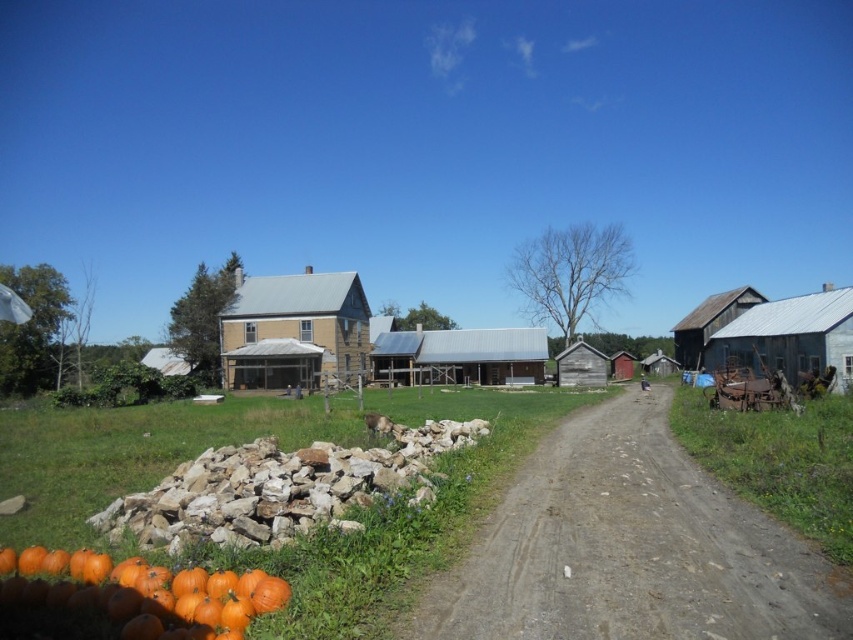
Question: Estimate the real-world distances between objects in this image. Which object is closer to the metallic gray barn at center?

Choices:
 (A) orange matte pumpkin at lower left
 (B) rusty metal barn at right

Answer: (B)

Question: Does orange matte pumpkin at lower left come behind metallic gray barn at center?

Choices:
 (A) yes
 (B) no

Answer: (B)

Question: Does rusty metal barn at right have a lesser width compared to rustic wood barn at right?

Choices:
 (A) yes
 (B) no

Answer: (A)

Question: Which point is farther from the camera taking this photo?

Choices:
 (A) (834, 378)
 (B) (628, 451)

Answer: (A)

Question: Is beige wooden barn at center bigger than rustic wood barn at right?

Choices:
 (A) no
 (B) yes

Answer: (A)

Question: Which object is closer to the camera taking this photo?

Choices:
 (A) beige wooden barn at center
 (B) rustic wood barn at right

Answer: (A)